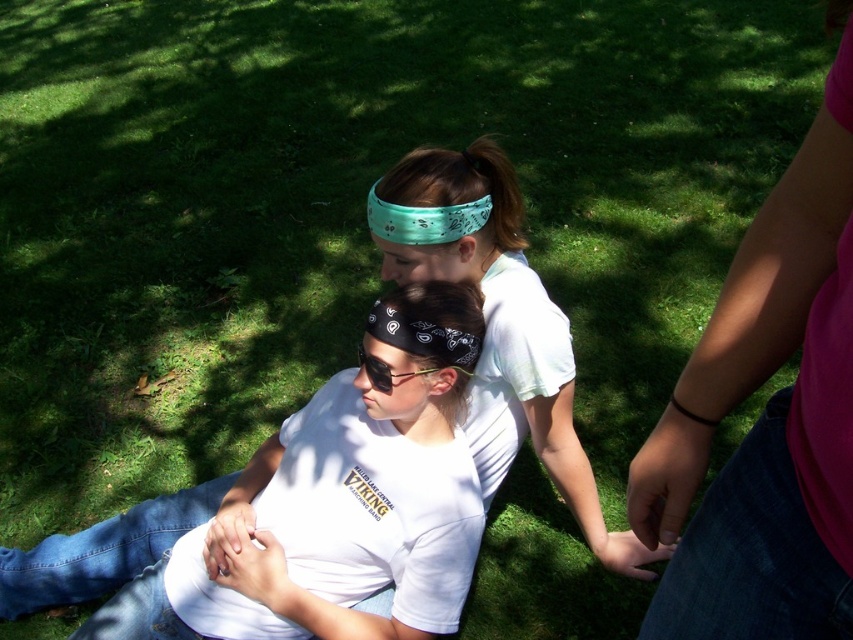
Question: Among these points, which one is farthest from the camera?

Choices:
 (A) (750, 550)
 (B) (381, 355)
 (C) (277, 458)

Answer: (C)

Question: Does white cotton t-shirt at center have a greater width compared to black reflective sunglasses at center?

Choices:
 (A) yes
 (B) no

Answer: (A)

Question: Is white cotton t-shirt at center above green bandana at center?

Choices:
 (A) yes
 (B) no

Answer: (B)

Question: Observing the image, what is the correct spatial positioning of white cotton t-shirt at center in reference to black bandana at center?

Choices:
 (A) right
 (B) left

Answer: (B)

Question: Considering the real-world distances, which object is closest to the green bandana at center?

Choices:
 (A) white cotton t-shirt at center
 (B) black bandana at center
 (C) black reflective sunglasses at center
 (D) pink fabric at upper right

Answer: (B)

Question: Based on their relative distances, which object is farther from the black reflective sunglasses at center?

Choices:
 (A) black bandana at center
 (B) white cotton t-shirt at center

Answer: (B)